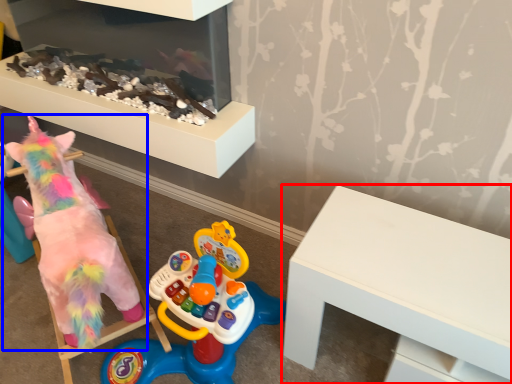
Question: Which object appears farthest to the camera in this image, table (highlighted by a red box) or toy (highlighted by a blue box)?

Choices:
 (A) table
 (B) toy

Answer: (B)